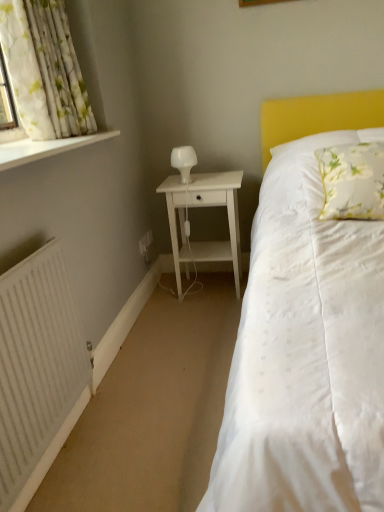
Image resolution: width=384 pixels, height=512 pixels. What are the coordinates of `unoccupied space behind white matte radiator at lower left` in the screenshot? It's located at (131, 384).